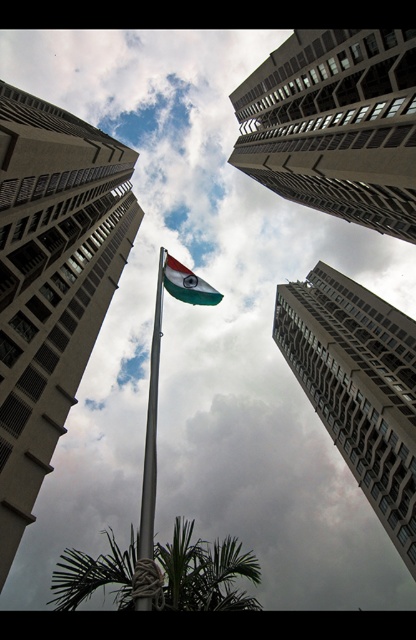
You are a photographer standing at the base of the metallic pole at center, aiming to capture the entire concrete building at center in your shot. Given your current position, can you fit the entire structure into your camera frame without moving closer or farther away?

The concrete building at center is larger in size than the metallic pole at center, so from your current position at the base of the metallic pole at center, you cannot fit the entire concrete building at center into your camera frame without moving closer or farther away.

You are standing at the base of the flagpole in the image. Looking up, you notice a point marked at coordinates (336, 125). What does this point represent?

The point at (336, 125) represents the gray concrete building at upper center.

You are standing at the base of the flagpole and want to walk towards the gray concrete building at upper center. Which direction should you move relative to the green leafy palm tree at lower center?

You should move to the right of the green leafy palm tree at lower center because the gray concrete building at upper center is positioned on the right side of it.